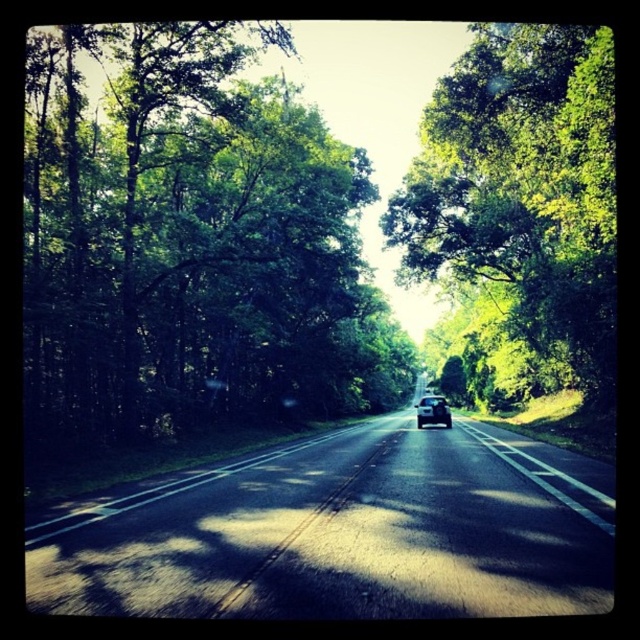
Question: Does green leafy tree at center have a greater width compared to shiny black car at center?

Choices:
 (A) no
 (B) yes

Answer: (B)

Question: Among these objects, which one is nearest to the camera?

Choices:
 (A) shiny black car at center
 (B) black asphalt road at center
 (C) green leafy tree at center
 (D) green leafy tree at left

Answer: (B)

Question: Which of the following is the farthest from the observer?

Choices:
 (A) (308, 525)
 (B) (442, 420)
 (C) (52, 262)

Answer: (B)

Question: Estimate the real-world distances between objects in this image. Which object is farther from the green leafy tree at center?

Choices:
 (A) green leafy tree at left
 (B) black asphalt road at center
 (C) shiny black car at center

Answer: (B)

Question: Is black asphalt road at center positioned before green leafy tree at center?

Choices:
 (A) no
 (B) yes

Answer: (B)

Question: Is green leafy tree at left to the left of shiny black car at center from the viewer's perspective?

Choices:
 (A) yes
 (B) no

Answer: (A)